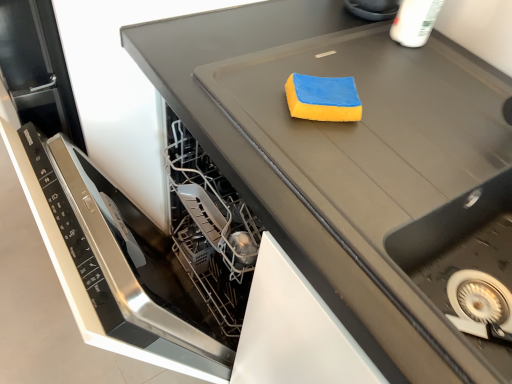
In order to click on free space in front of blue sponge at center in this screenshot , I will do `click(339, 157)`.